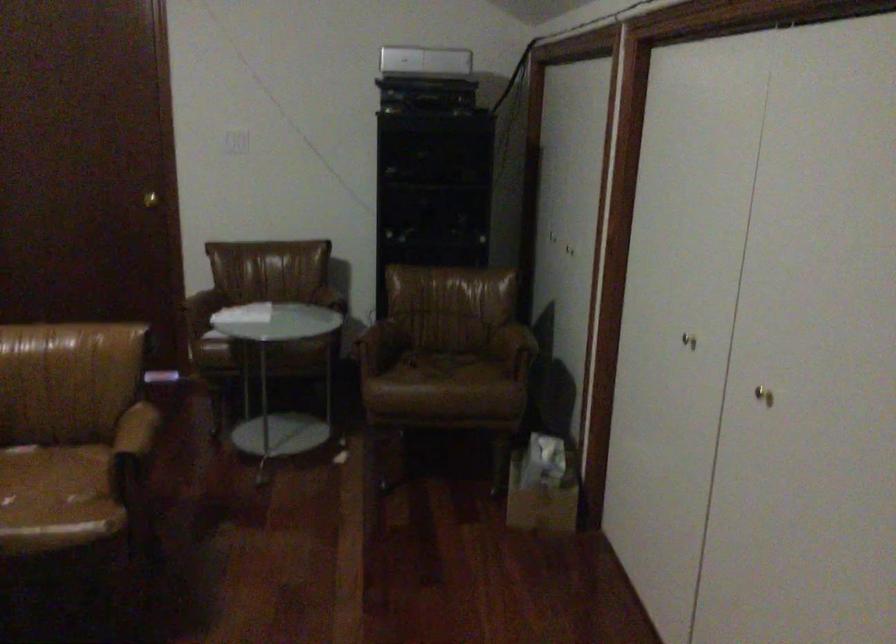
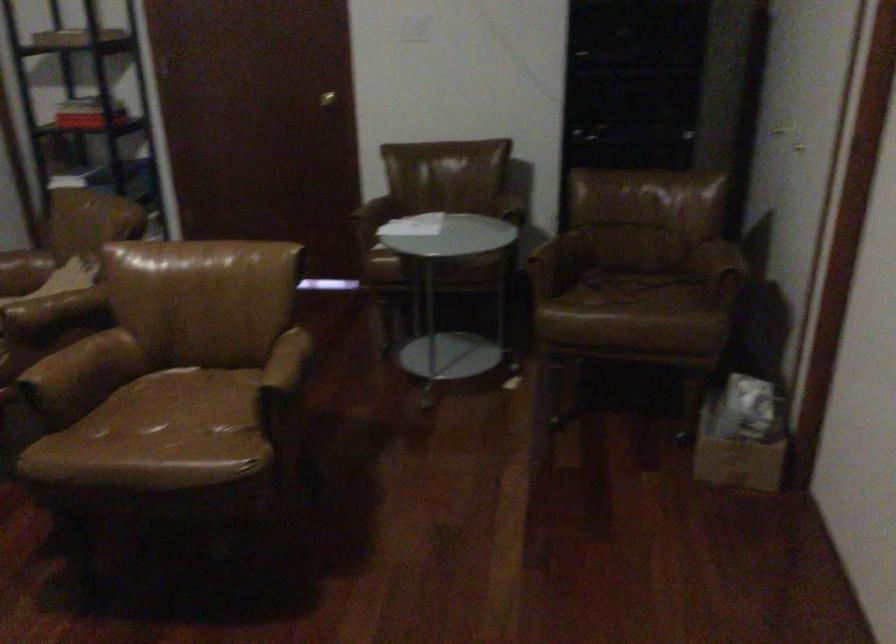
Locate, in the second image, the point that corresponds to pixel 440 365 in the first image.

(627, 288)